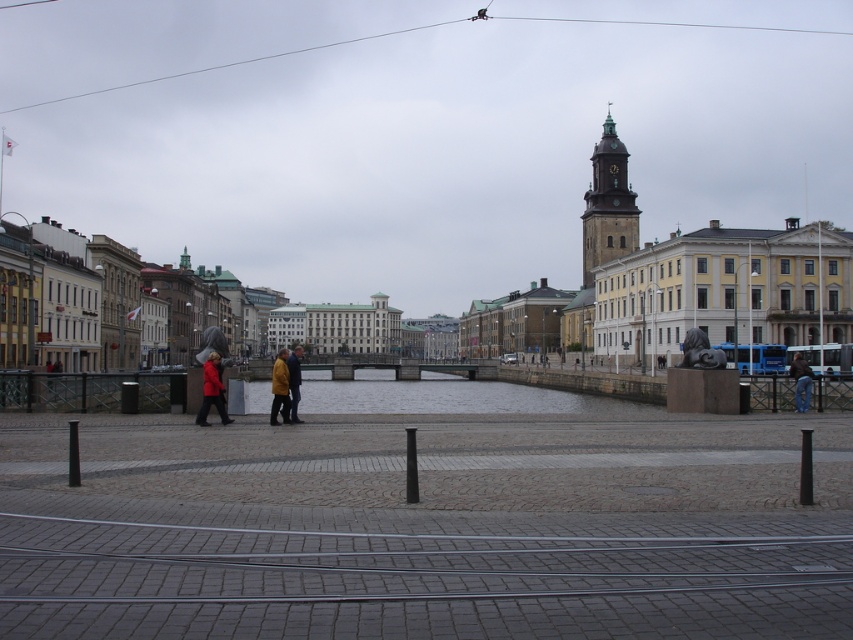
You are standing at the center of the paved area with tram tracks. You need to find the jeans at lower right. In which direction should you move to reach them?

The jeans at lower right are located at point 0.597 on the x axis and 0.940 on the y axis. Since you are at the center, you should move towards the lower right direction to reach them.

You are a tourist standing in the city and want to take a photo of the golden stone tower at upper right while also including the yellow leather jacket at center in the frame. Which direction should you move to ensure both objects are in your camera view?

You should move to the left so that the golden stone tower at upper right, which is to the right of the yellow leather jacket at center, comes into view alongside the jacket.

You are standing on the waterfront and see the clear water at center and the matte red coat at center. Which object is closer to you?

The clear water at center is closer to you than the matte red coat at center.